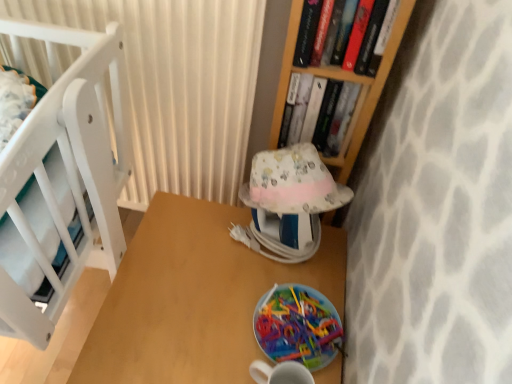
Where is `free space above wooden table at center (from a real-world perspective)`? The image size is (512, 384). free space above wooden table at center (from a real-world perspective) is located at coordinates (224, 292).